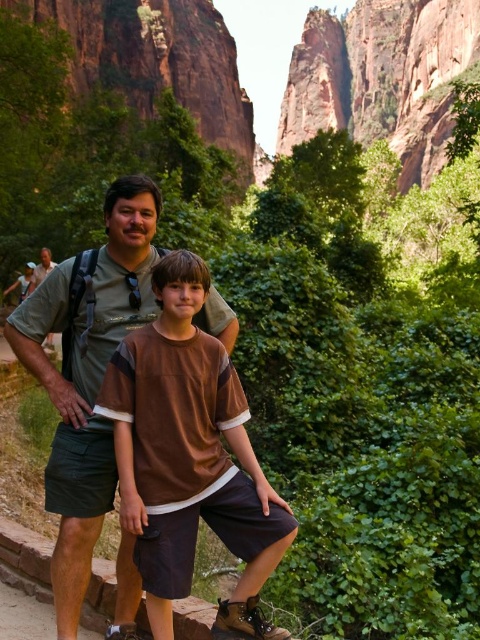
You are a photographer trying to capture a photo of the two people in the scene. You want to ensure that both the brown cotton shirt at center and the green fabric shirt at center are fully visible in the frame. Which shirt should you focus on to ensure the entire shirt is captured without cropping?

The brown cotton shirt at center has a lesser width compared to the green fabric shirt at center, so focusing on the green fabric shirt at center ensures the entire shirt is captured without cropping.